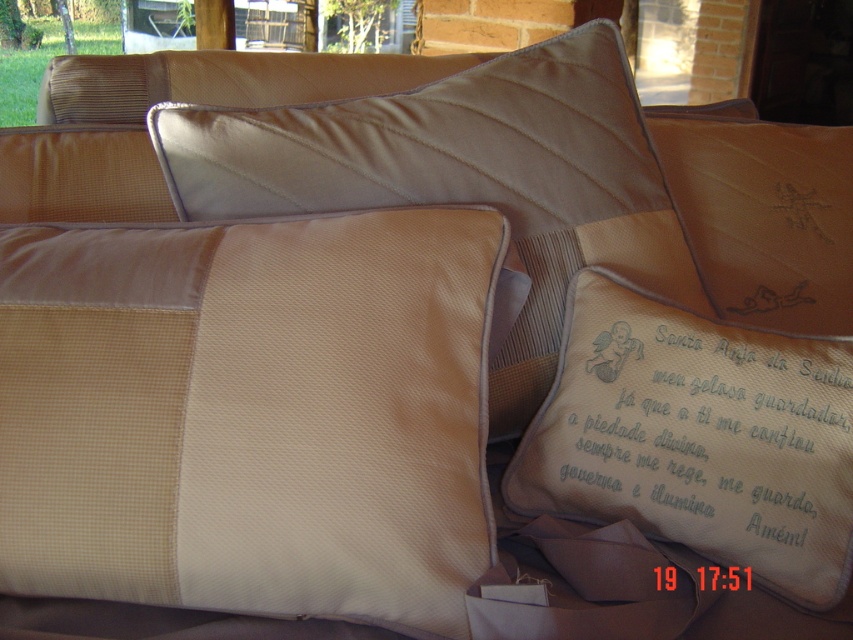
You are standing in front of the decorative pillows arrangement. You need to find the white embroidered pillow at lower right. According to the coordinates provided, where exactly is it positioned?

The white embroidered pillow at lower right is located at point (697,436).

You are arranging decorative pillows on a sofa. You have a satin beige pillow at center and a satin embroidered pillow at center. According to the image, which one is placed higher up?

The satin embroidered pillow at center is placed higher up because the satin beige pillow at center is below it.

Looking at this image, you are organizing a display of pillows and need to place the white embroidered pillow at lower right and the satin embroidered pillow at center. If the display area has a maximum size limit of 30 cm for the larger pillow, will both pillows fit within the space?

The satin embroidered pillow at center is larger than the white embroidered pillow at lower right. Since the maximum size allowed for the larger pillow is 30 cm, both pillows will fit as long as the satin embroidered pillow at center does not exceed 30 cm in size.